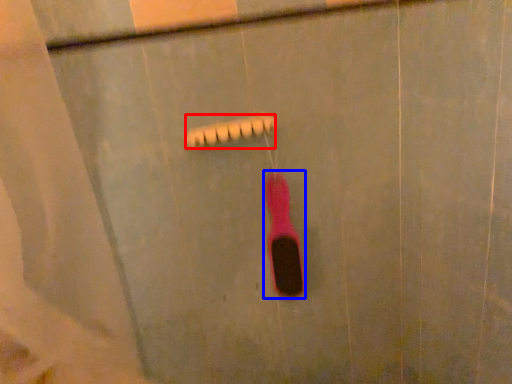
Question: Which object appears farthest to the camera in this image, shower (highlighted by a red box) or toothbrush (highlighted by a blue box)?

Choices:
 (A) shower
 (B) toothbrush

Answer: (B)